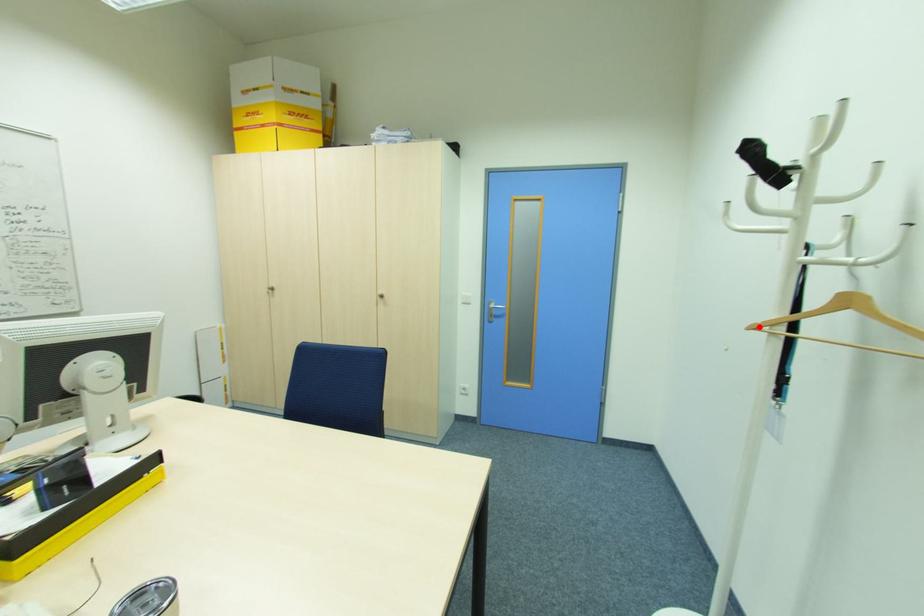
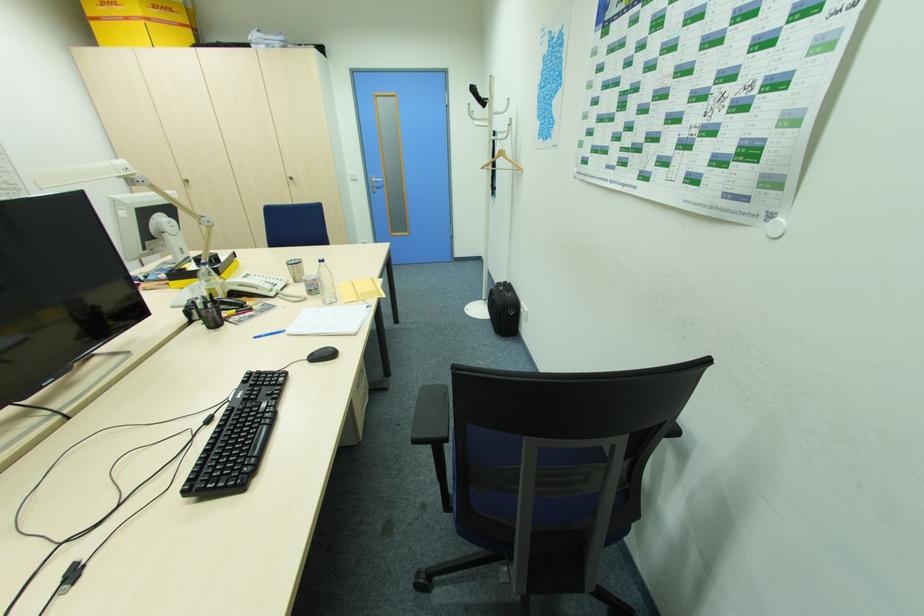
Question: I am providing you with two images of the same scene from different viewpoints. Given a red point in image1, look at the same physical point in image2. Is it:

Choices:
 (A) Closer to the viewpoint
 (B) Farther from the viewpoint

Answer: (A)